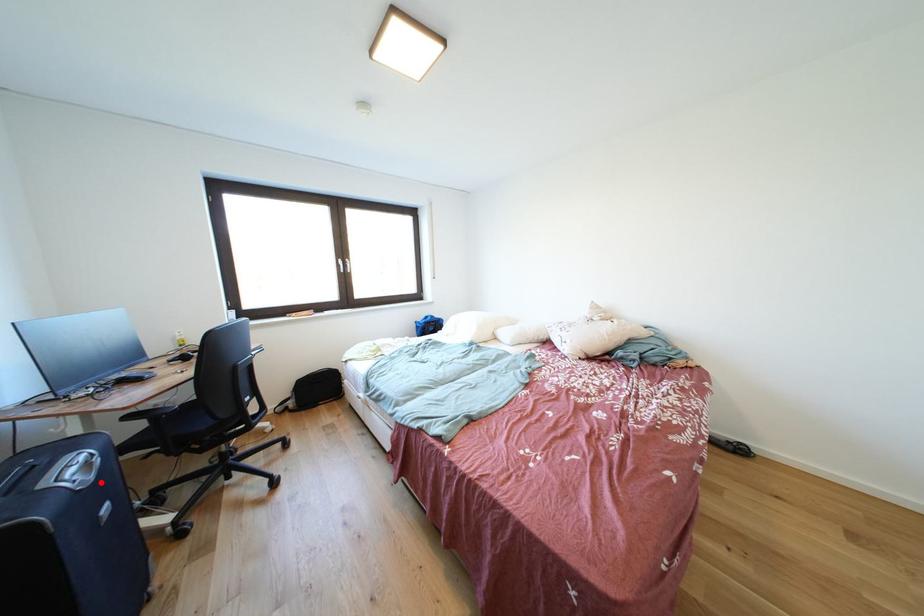
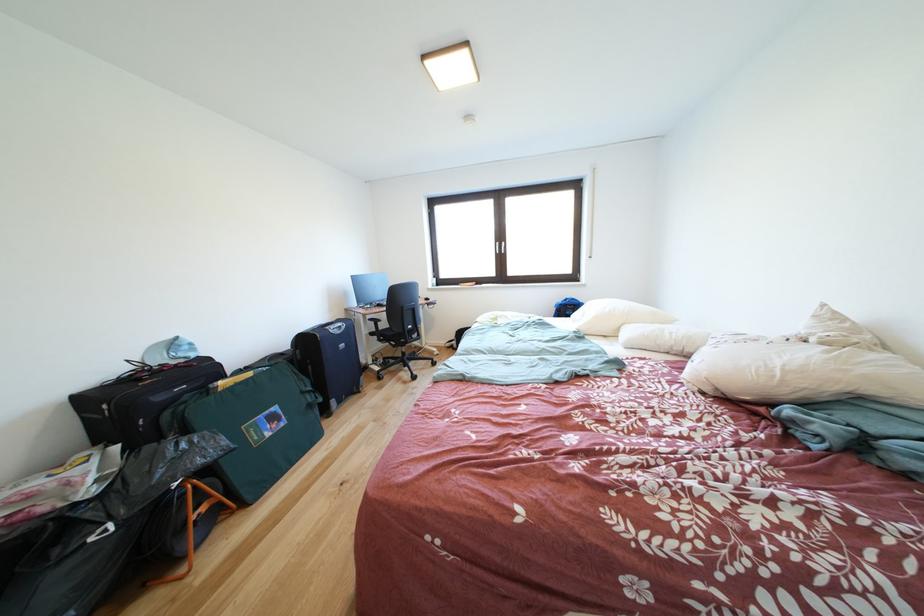
Question: I am providing you with two images of the same scene from different viewpoints. A red point is shown in image1. For the corresponding object point in image2, is it positioned nearer or farther from the camera?

Choices:
 (A) Nearer
 (B) Farther

Answer: (A)